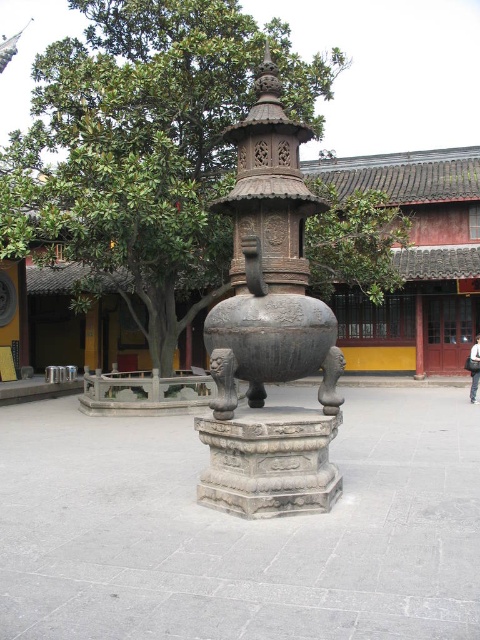
Can you confirm if green leafy tree at center is positioned below dark gray stone incense burner at center?

Incorrect, green leafy tree at center is not positioned below dark gray stone incense burner at center.

Is green leafy tree at center taller than dark gray stone incense burner at center?

Correct, green leafy tree at center is much taller as dark gray stone incense burner at center.

Does point (186, 195) come in front of point (252, 221)?

That is False.

Identify the location of green leafy tree at center. pos(145,148).

In the scene shown: Is dark gray stone incense burner at center closer to camera compared to polished bronze incense burner at center?

That is True.

Which is more to the left, dark gray stone incense burner at center or polished bronze incense burner at center?

From the viewer's perspective, polished bronze incense burner at center appears more on the left side.

Does point (339, 356) come farther from viewer compared to point (212, 332)?

Yes, it is behind point (212, 332).

You are a GUI agent. You are given a task and a screenshot of the screen. Output one action in this format:
    pyautogui.click(x=<x>, y=<y>)
    Task: Click on the dark gray stone incense burner at center
    Image resolution: width=480 pixels, height=640 pixels.
    Given the screenshot: What is the action you would take?
    pyautogui.click(x=269, y=330)

Does point (158, 291) lie in front of point (252, 323)?

No, (158, 291) is behind (252, 323).

Between green leafy tree at center and polished bronze incense burner at center, which one has less height?

polished bronze incense burner at center

Who is more forward, (218, 4) or (262, 355)?

Positioned in front is point (262, 355).

At what (x,y) coordinates should I click in order to perform the action: click on green leafy tree at center. Please return your answer as a coordinate pair (x, y). The image size is (480, 640). Looking at the image, I should click on (145, 148).